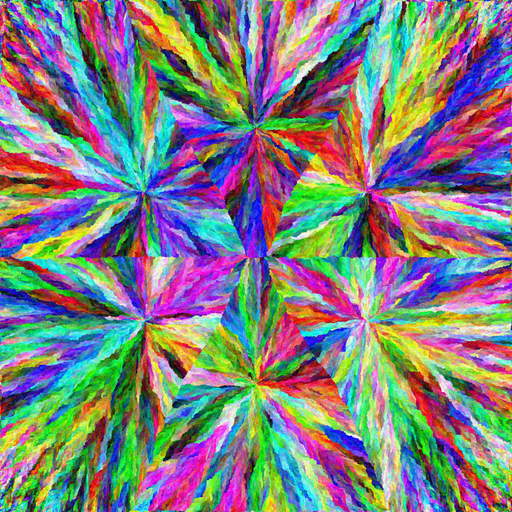
This screenshot has width=512, height=512. What are the coordinates of `red paint` in the screenshot? It's located at (66, 298), (424, 403), (316, 362), (333, 317), (305, 136), (61, 185), (44, 95).